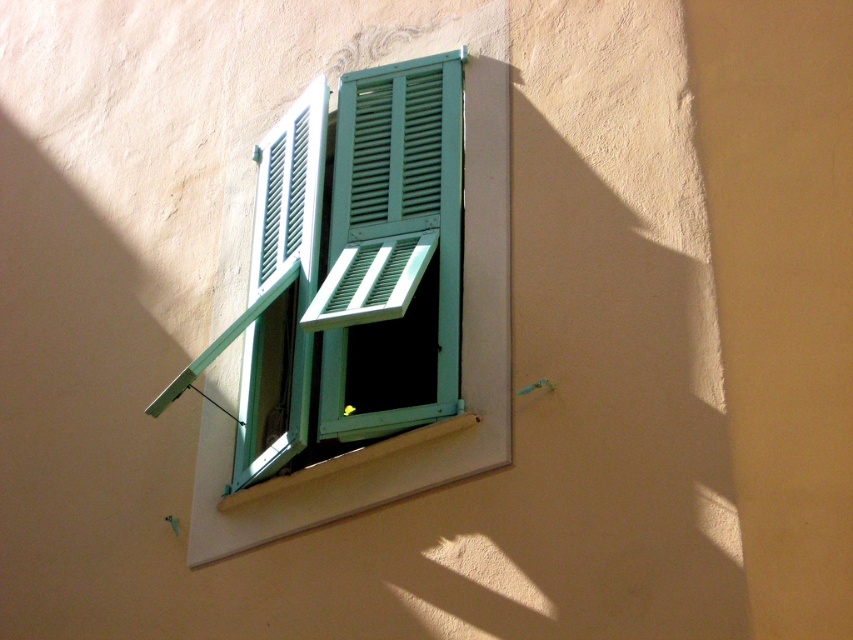
You are an interior designer assessing the window setup. You notice the teal painted wood at center and the white painted wood at lower center. Which part of the window has a narrower width?

The teal painted wood at center has a narrower width than the white painted wood at lower center.

You are an interior designer assessing the placement of two wooden elements in a room. You see the teal painted wood at center and the white painted wood at lower center. Which one is positioned higher up on the wall?

The teal painted wood at center is positioned higher up on the wall compared to the white painted wood at lower center, as it is located above it.

You are standing in front of the window with shutters. You see the teal painted wood at center and the white painted wood at lower center. Which one is closer to you?

The teal painted wood at center is closer to you because the white painted wood at lower center is behind it.